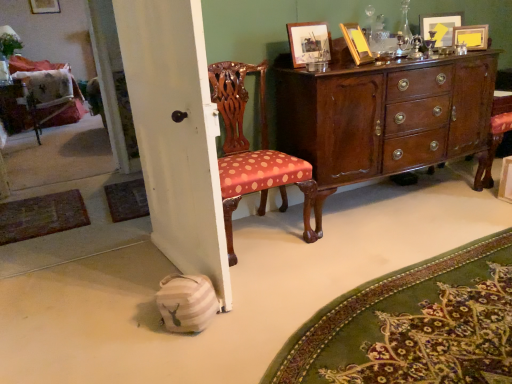
Question: Are woven brown mat at lower left, the 2th mat in the left-to-right sequence, and beige woven mat at lower left, which is counted as the third mat, starting from the back, located far from each other?

Choices:
 (A) yes
 (B) no

Answer: (A)

Question: Is woven brown mat at lower left, which ranks as the 1th mat in back-to-front order, with beige woven mat at lower left, placed as the 1th mat when sorted from right to left?

Choices:
 (A) no
 (B) yes

Answer: (A)

Question: Considering the relative sizes of woven brown mat at lower left, which ranks as the 1th mat in back-to-front order, and beige woven mat at lower left, the 3th mat when ordered from left to right, in the image provided, is woven brown mat at lower left, which ranks as the 1th mat in back-to-front order, taller than beige woven mat at lower left, the 3th mat when ordered from left to right,?

Choices:
 (A) yes
 (B) no

Answer: (B)

Question: Can we say woven brown mat at lower left, which ranks as the 1th mat in back-to-front order, lies outside beige woven mat at lower left, the 3th mat when ordered from left to right?

Choices:
 (A) no
 (B) yes

Answer: (B)

Question: Is woven brown mat at lower left, which ranks as the 1th mat in back-to-front order, positioned with its back to beige woven mat at lower left, marked as the 1th mat in a front-to-back arrangement?

Choices:
 (A) yes
 (B) no

Answer: (B)

Question: Do you think woven brown mat at lower left, the 2th mat in the left-to-right sequence, is within wooden picture frame at upper left, marked as the 1th picture frame in a back-to-front arrangement, or outside of it?

Choices:
 (A) inside
 (B) outside

Answer: (B)

Question: Does point (124, 185) appear closer or farther from the camera than point (49, 4)?

Choices:
 (A) closer
 (B) farther

Answer: (A)

Question: Relative to wooden picture frame at upper left, the 5th picture frame positioned from the bottom, is woven brown mat at lower left, which ranks as the 1th mat in back-to-front order, in front or behind?

Choices:
 (A) front
 (B) behind

Answer: (A)

Question: From the image's perspective, relative to wooden picture frame at upper left, the first picture frame positioned from the top, is woven brown mat at lower left, which is the third mat from front to back, above or below?

Choices:
 (A) below
 (B) above

Answer: (A)

Question: In terms of height, does green felt mat at lower left, the 2th mat in the front-to-back sequence, look taller or shorter compared to polished dark wood cabinet at center?

Choices:
 (A) short
 (B) tall

Answer: (A)

Question: From a real-world perspective, relative to polished dark wood cabinet at center, is green felt mat at lower left, the 2th mat in the front-to-back sequence, vertically above or below?

Choices:
 (A) below
 (B) above

Answer: (A)

Question: Considering the positions of point (0, 230) and point (440, 157), is point (0, 230) closer or farther from the camera than point (440, 157)?

Choices:
 (A) farther
 (B) closer

Answer: (A)

Question: Is green felt mat at lower left, the 1th mat when ordered from left to right, in front of or behind polished dark wood cabinet at center in the image?

Choices:
 (A) front
 (B) behind

Answer: (B)

Question: Is beige woven mat at lower left, placed as the 1th mat when sorted from right to left, inside the boundaries of polished wood chair at center, or outside?

Choices:
 (A) outside
 (B) inside

Answer: (A)

Question: In the image, is beige woven mat at lower left, marked as the 1th mat in a front-to-back arrangement, positioned in front of or behind polished wood chair at center?

Choices:
 (A) front
 (B) behind

Answer: (A)